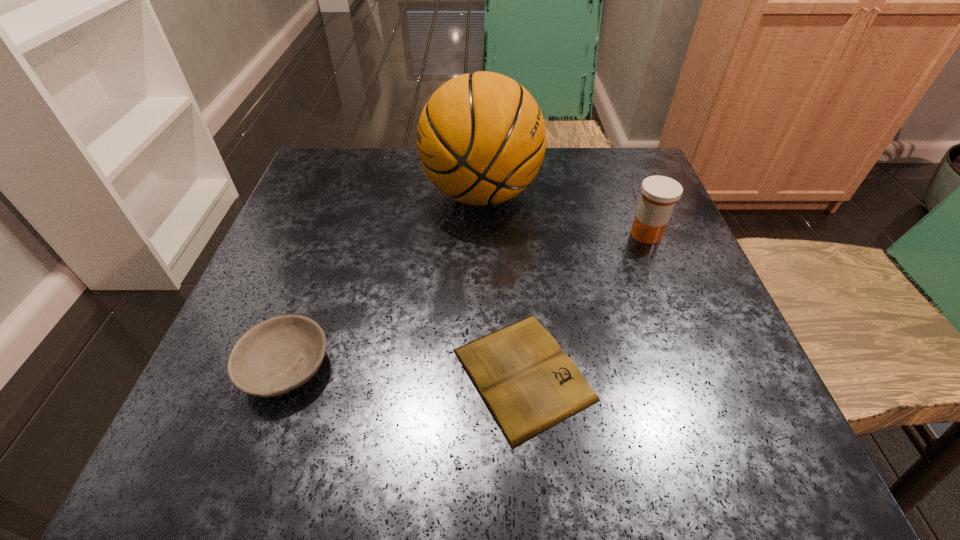
Where is `the tallest object`? the tallest object is located at coordinates (481, 138).

Image resolution: width=960 pixels, height=540 pixels. I want to click on medicine, so click(659, 193).

I want to click on the rightmost object, so click(x=659, y=193).

Find the location of a particular element. The width and height of the screenshot is (960, 540). bowl is located at coordinates (280, 354).

Locate an element on the screen. Image resolution: width=960 pixels, height=540 pixels. the second shortest object is located at coordinates (280, 354).

Find the location of a particular element. book is located at coordinates (529, 385).

You are a GUI agent. You are given a task and a screenshot of the screen. Output one action in this format:
    pyautogui.click(x=<x>, y=<y>)
    Task: Click on the free spot located 0.150m on the surface of the tallest object near the brand logo
    The height and width of the screenshot is (540, 960).
    Given the screenshot: What is the action you would take?
    pyautogui.click(x=352, y=194)

The width and height of the screenshot is (960, 540). What are the coordinates of `free space located on the surface of the tallest object near the brand logo` in the screenshot? It's located at (315, 194).

The image size is (960, 540). What are the coordinates of `vacant space located 0.130m on the surface of the tallest object near the brand logo` in the screenshot? It's located at (362, 194).

I want to click on vacant position located 0.270m on the label of the rightmost object, so click(x=487, y=234).